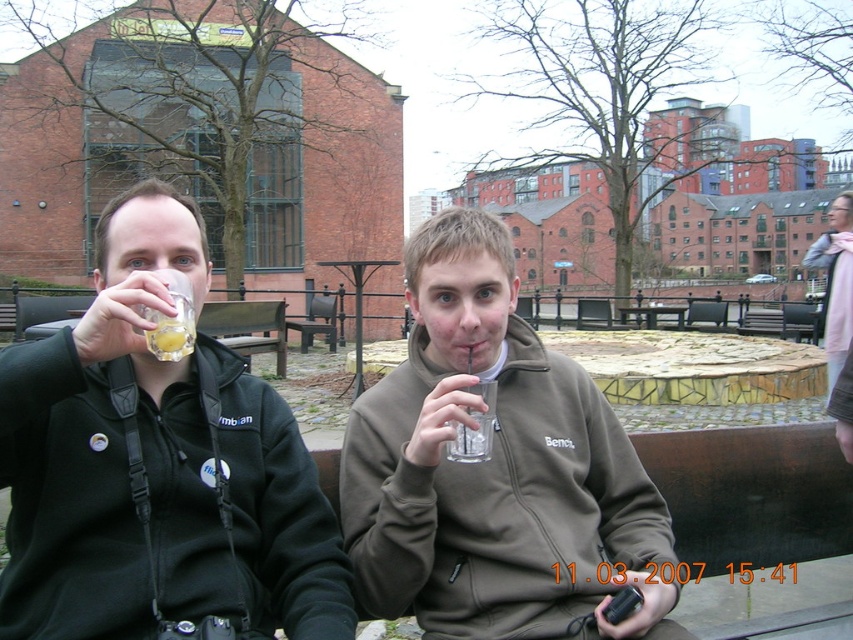
Which is in front, point (567, 625) or point (157, 321)?

Point (157, 321)

Is point (474, 260) farther from camera compared to point (170, 356)?

Yes, it is.

Does point (575, 588) come in front of point (178, 340)?

No, it is behind (178, 340).

You are a GUI agent. You are given a task and a screenshot of the screen. Output one action in this format:
    pyautogui.click(x=<x>, y=<y>)
    Task: Click on the matte brown hoodie at center
    This screenshot has width=853, height=640.
    Given the screenshot: What is the action you would take?
    pyautogui.click(x=494, y=468)

Is matte black jacket at left positioned at the back of matte brown hoodie at center?

No, it is in front of matte brown hoodie at center.

Between matte black jacket at left and matte brown hoodie at center, which one has more height?

Standing taller between the two is matte brown hoodie at center.

The height and width of the screenshot is (640, 853). I want to click on matte black jacket at left, so click(x=157, y=467).

What are the coordinates of `matte black jacket at left` in the screenshot? It's located at (157, 467).

Does matte black jacket at left appear under translucent glass at upper left?

Correct, matte black jacket at left is located below translucent glass at upper left.

Does matte black jacket at left have a greater height compared to translucent glass at upper left?

Yes, matte black jacket at left is taller than translucent glass at upper left.

Which is in front, point (39, 564) or point (164, 339)?

Point (164, 339)

Where is `matte black jacket at left`? The width and height of the screenshot is (853, 640). matte black jacket at left is located at coordinates (157, 467).